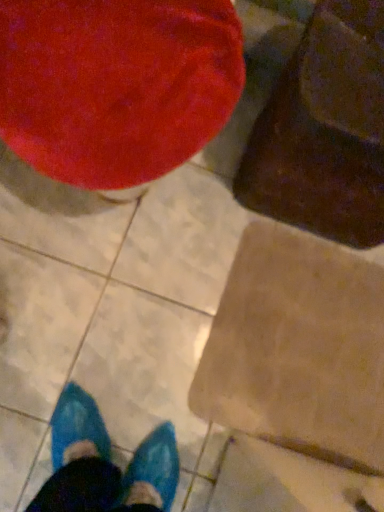
Locate an element on the screen. The height and width of the screenshot is (512, 384). free space between velvet red bean bag chair at upper left, the first bean bag chair viewed from the left, and velvety brown bean bag chair at upper right, the second bean bag chair viewed from the left is located at coordinates (241, 224).